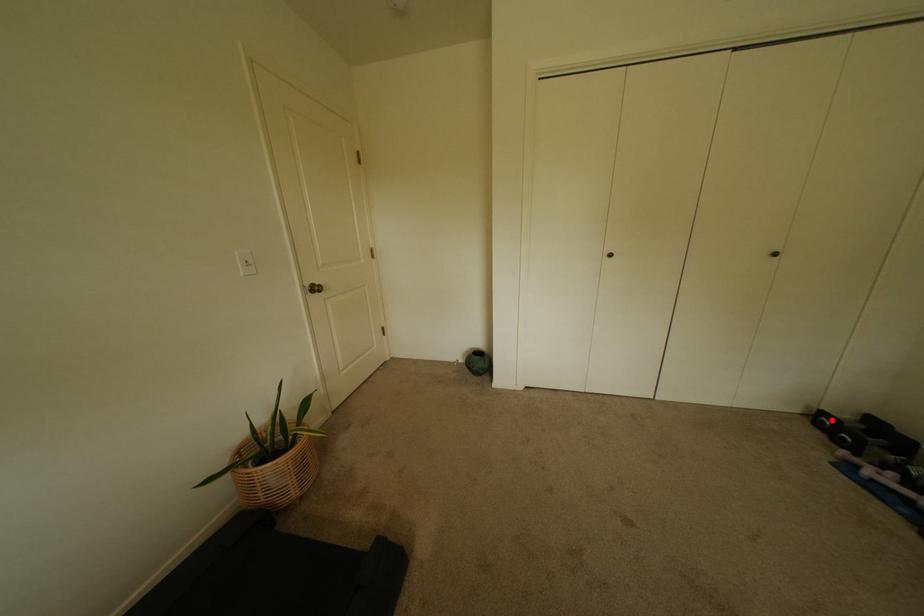
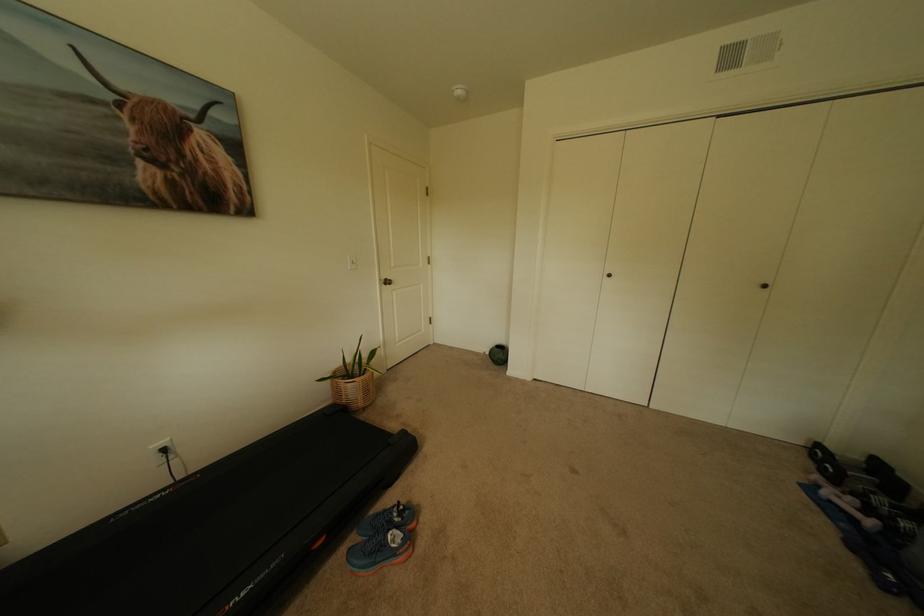
Where in the second image is the point corresponding to the highlighted location from the first image?

(827, 452)